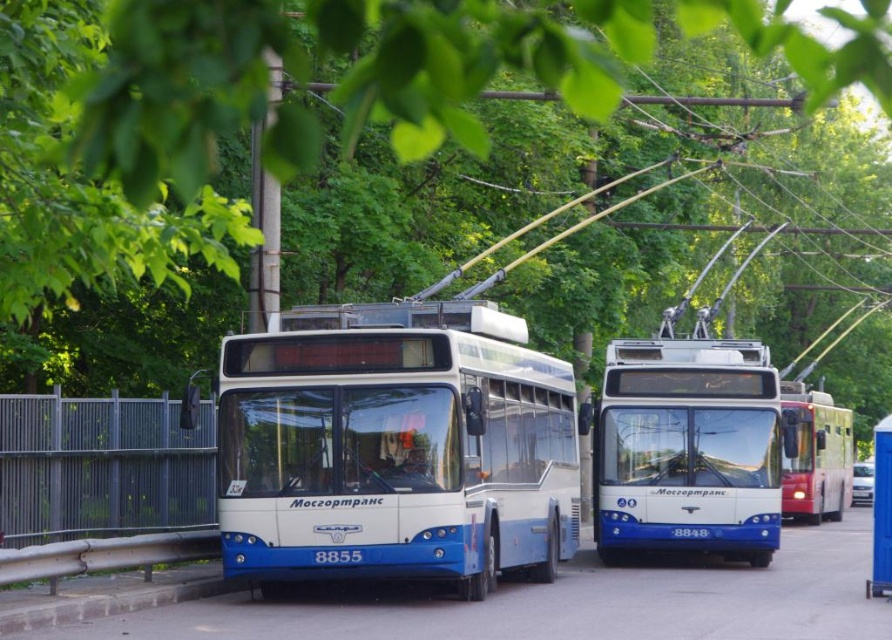
In the scene shown: Who is positioned more to the left, blue metallic bus at center or blue plastic bus stop at lower right?

blue metallic bus at center

Does point (292, 422) come behind point (881, 556)?

That is False.

Image resolution: width=892 pixels, height=640 pixels. What are the coordinates of `blue metallic bus at center` in the screenshot? It's located at (395, 448).

Is point (572, 484) positioned before point (803, 512)?

Yes, it is in front of point (803, 512).

What are the coordinates of `blue metallic bus at center` in the screenshot? It's located at (395, 448).

I want to click on blue metallic bus at center, so 395,448.

Who is shorter, red glossy trolleybus at right or blue plastic bus stop at lower right?

With less height is blue plastic bus stop at lower right.

Can you confirm if red glossy trolleybus at right is positioned above blue plastic bus stop at lower right?

Yes, red glossy trolleybus at right is above blue plastic bus stop at lower right.

What are the coordinates of `red glossy trolleybus at right` in the screenshot? It's located at (816, 456).